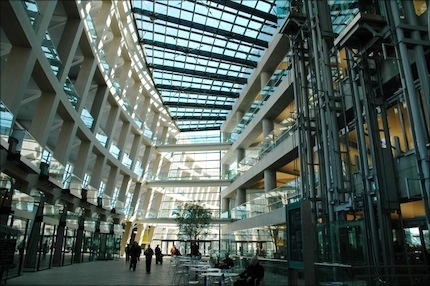
What are the coordinates of `chair` in the screenshot? It's located at (172, 265).